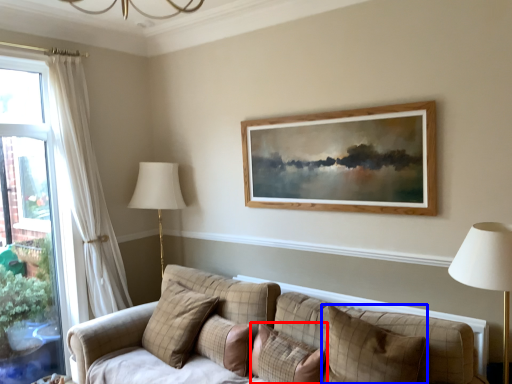
Question: Which of the following is the farthest to the observer, pillow (highlighted by a red box) or pillow (highlighted by a blue box)?

Choices:
 (A) pillow
 (B) pillow

Answer: (A)